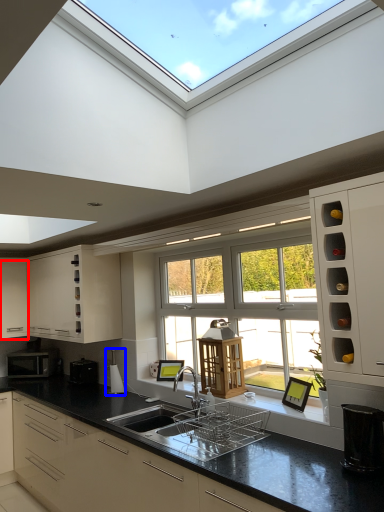
Question: Which of the following is the closest to the observer, cabinetry (highlighted by a red box) or appliance (highlighted by a blue box)?

Choices:
 (A) cabinetry
 (B) appliance

Answer: (B)